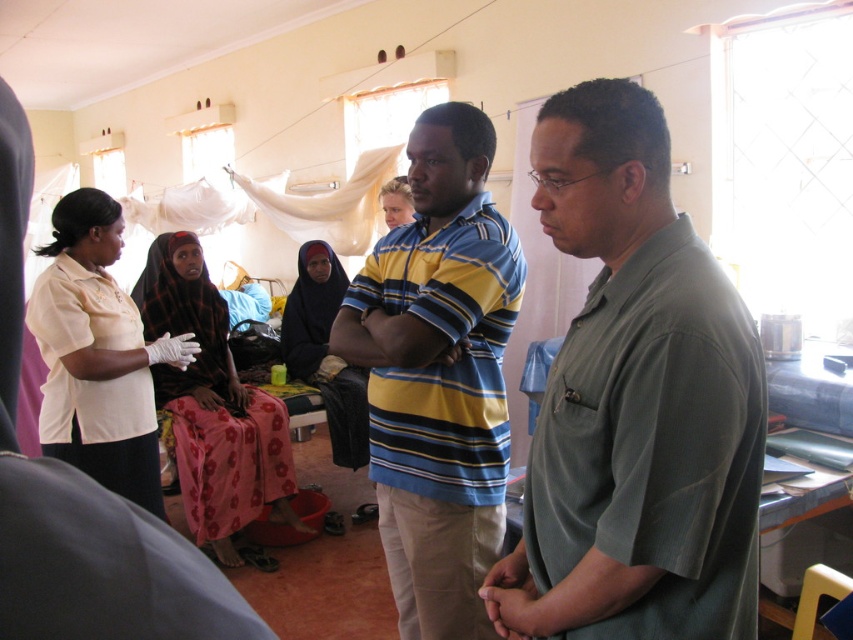
Question: Is green matte shirt at center wider than striped cotton shirt at center?

Choices:
 (A) no
 (B) yes

Answer: (A)

Question: Among these points, which one is nearest to the camera?

Choices:
 (A) (177, 400)
 (B) (711, 604)
 (C) (120, 445)

Answer: (B)

Question: Does matte white shirt at left lie behind black fabric dress at center?

Choices:
 (A) yes
 (B) no

Answer: (B)

Question: Does green matte shirt at center have a lesser width compared to black fabric dress at center?

Choices:
 (A) yes
 (B) no

Answer: (A)

Question: Which of the following is the closest to the observer?

Choices:
 (A) green matte shirt at center
 (B) striped cotton shirt at center
 (C) matte white shirt at left
 (D) black fabric dress at center

Answer: (A)

Question: Which point is closer to the camera?

Choices:
 (A) black fabric dress at center
 (B) green matte shirt at center

Answer: (B)